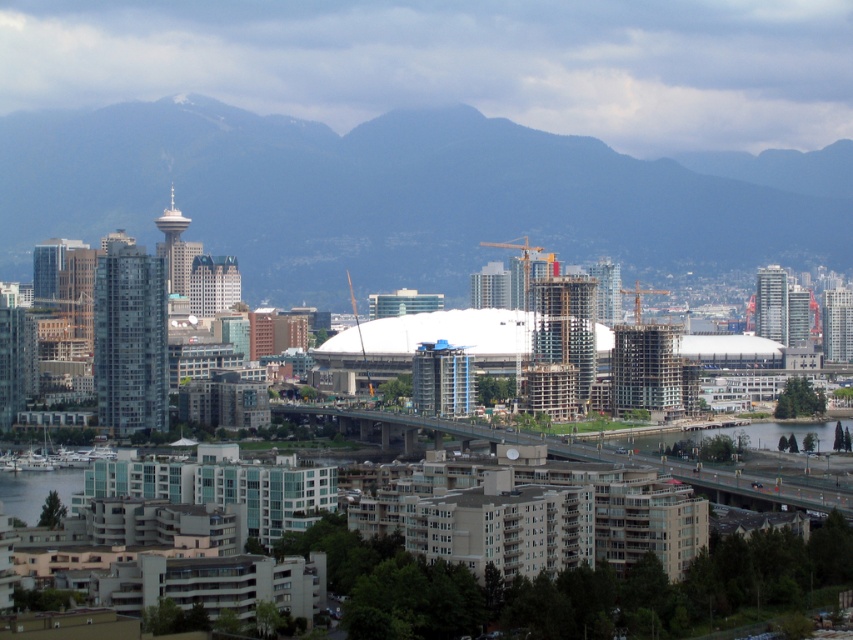
Which is behind, point (45, 493) or point (766, 420)?

Point (766, 420)

Does clear water at lower left have a smaller size compared to clear water at lower right?

Yes.

Measure the distance between clear water at lower left and camera.

671.32 meters

The height and width of the screenshot is (640, 853). I want to click on clear water at lower left, so click(36, 490).

Does blue-gray rock formation at upper center appear on the left side of clear water at lower left?

No, blue-gray rock formation at upper center is not to the left of clear water at lower left.

Is blue-gray rock formation at upper center above clear water at lower left?

Correct, blue-gray rock formation at upper center is located above clear water at lower left.

Find the location of `blue-gray rock formation at upper center`. blue-gray rock formation at upper center is located at coordinates (405, 196).

Identify the location of blue-gray rock formation at upper center. (405, 196).

From the picture: Who is higher up, blue-gray rock formation at upper center or clear water at lower right?

blue-gray rock formation at upper center is higher up.

Between point (32, 230) and point (708, 422), which one is positioned behind?

The point (32, 230) is more distant.

Measure the distance between point (631, 244) and camera.

Point (631, 244) is 2172.53 feet from camera.

The width and height of the screenshot is (853, 640). Find the location of `blue-gray rock formation at upper center`. blue-gray rock formation at upper center is located at coordinates [405, 196].